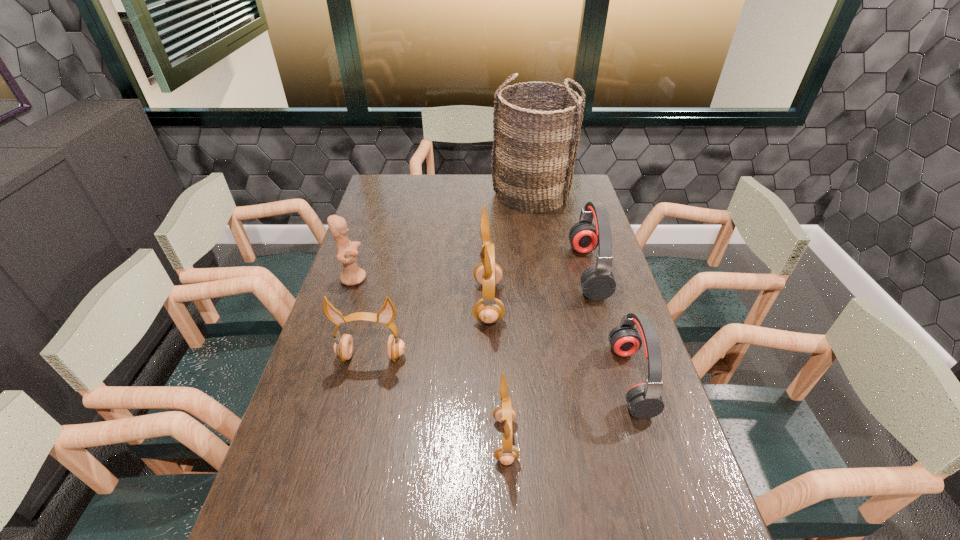
The width and height of the screenshot is (960, 540). What are the coordinates of `vacant area situated 0.400m on the ear cups of the smaller red earphone` in the screenshot? It's located at (465, 379).

Identify the location of vacant space located 0.210m on the ear cups of the smaller red earphone. The height and width of the screenshot is (540, 960). (537, 379).

Locate an element on the screen. Image resolution: width=960 pixels, height=540 pixels. free space located 0.060m on the front-facing side of the smallest brown earphone is located at coordinates (468, 440).

Find the location of a particular element. The image size is (960, 540). free spot located 0.060m on the front-facing side of the smallest brown earphone is located at coordinates (468, 440).

Where is `free space located on the front-facing side of the smallest brown earphone`? Image resolution: width=960 pixels, height=540 pixels. free space located on the front-facing side of the smallest brown earphone is located at coordinates (383, 440).

The width and height of the screenshot is (960, 540). I want to click on object present at the far edge, so click(x=536, y=137).

You are a GUI agent. You are given a task and a screenshot of the screen. Output one action in this format:
    pyautogui.click(x=<x>, y=<y>)
    Task: Click on the figurine at the left edge
    The height and width of the screenshot is (540, 960).
    Given the screenshot: What is the action you would take?
    pyautogui.click(x=347, y=252)

The width and height of the screenshot is (960, 540). In order to click on earphone present at the left edge in this screenshot , I will do `click(343, 347)`.

This screenshot has height=540, width=960. In order to click on basket that is at the right edge in this screenshot , I will do `click(536, 137)`.

Find the location of `object at the far right corner`. object at the far right corner is located at coordinates (536, 137).